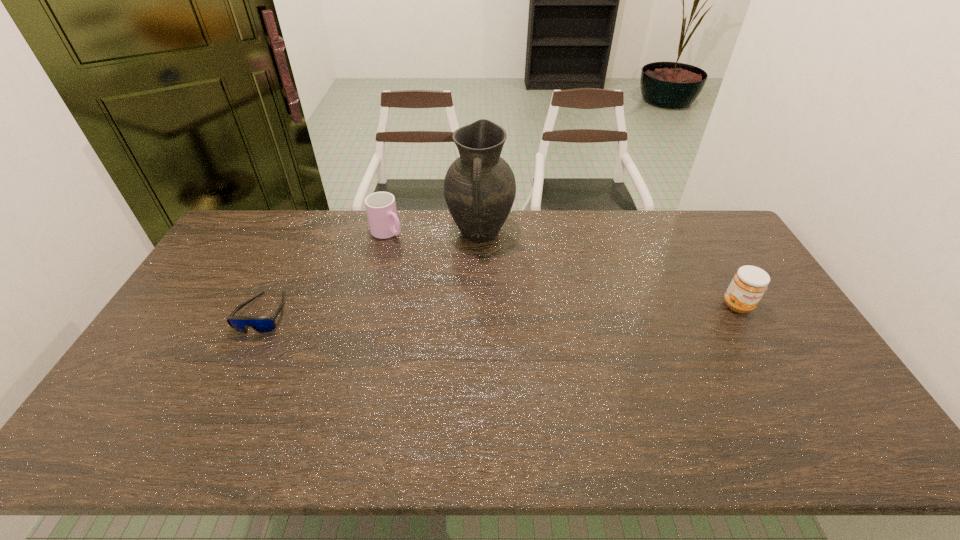
Identify the location of free region located on the side of the pitcher with the handle. This screenshot has width=960, height=540. (476, 271).

Locate an element on the screen. blank area located 0.240m with the handle on the side of the cup is located at coordinates (442, 273).

Find the location of `blank area located 0.110m with the handle on the side of the cup`. blank area located 0.110m with the handle on the side of the cup is located at coordinates (417, 255).

Find the location of a particular element. The width and height of the screenshot is (960, 540). vacant area situated 0.380m with the handle on the side of the cup is located at coordinates point(471,295).

Find the location of a particular element. The image size is (960, 540). pitcher positioned at the far edge is located at coordinates (479, 187).

Find the location of a particular element. The width and height of the screenshot is (960, 540). cup at the far edge is located at coordinates (381, 210).

This screenshot has height=540, width=960. In order to click on object that is at the right edge in this screenshot , I will do `click(749, 284)`.

In the image, there is a desktop. Identify the location of vacant space at the far edge. This screenshot has width=960, height=540. (649, 234).

What are the coordinates of `free space at the near edge of the desktop` in the screenshot? It's located at (419, 401).

Identify the location of free space at the right edge of the desktop. This screenshot has width=960, height=540. (726, 263).